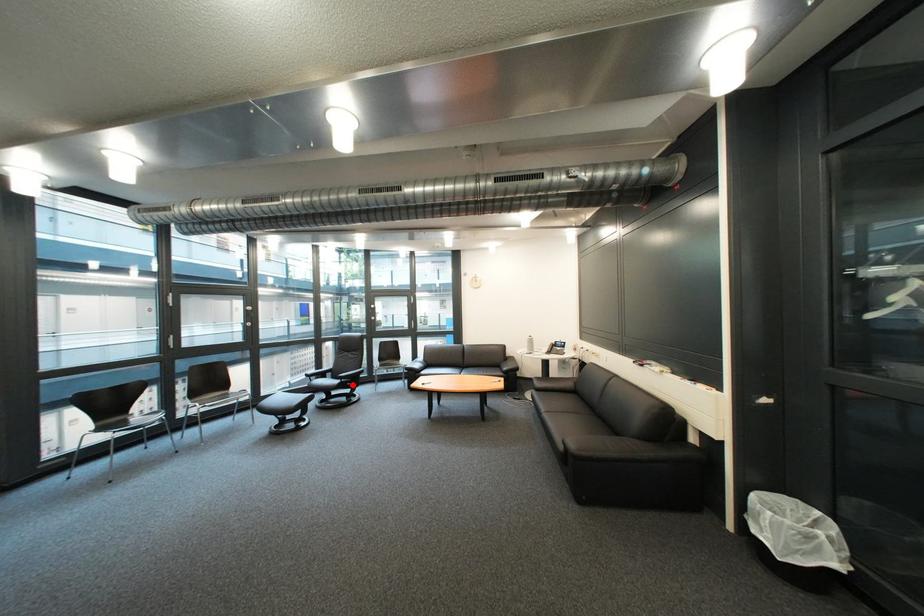
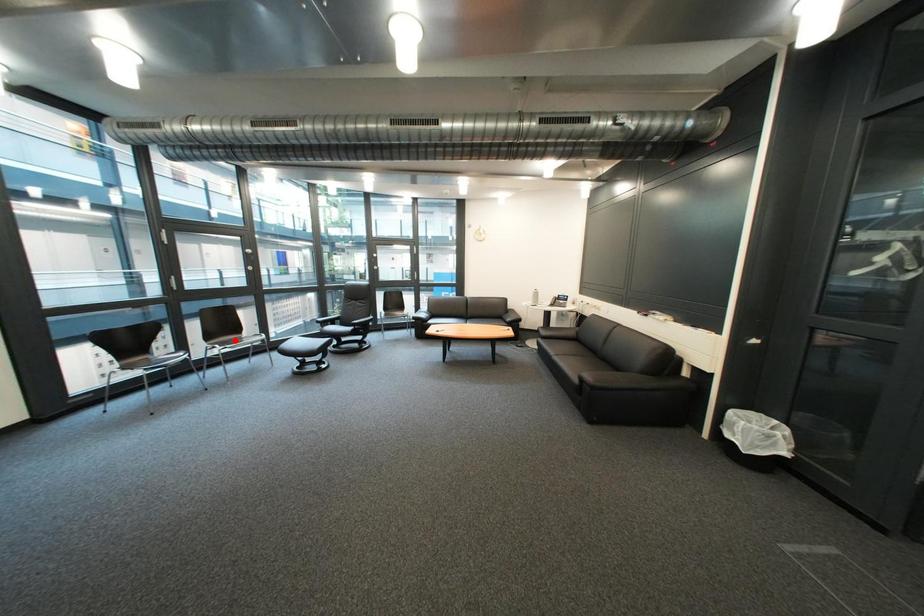
I am providing you with two images of the same scene from different viewpoints. A red point is marked on the first image and another point is marked on the second image. Are the points marked in image1 and image2 representing the same 3D position?

No